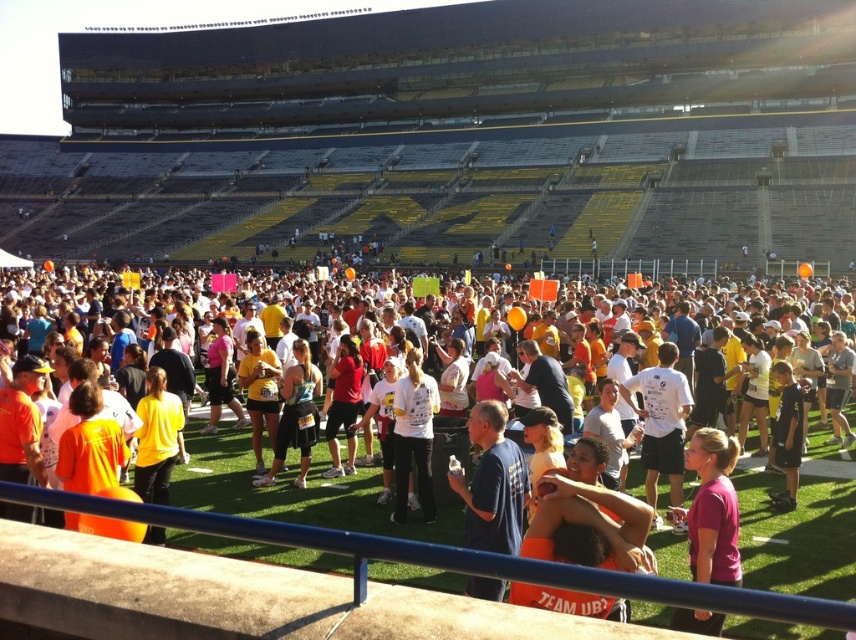
Question: Which point is closer to the camera?

Choices:
 (A) (497, 452)
 (B) (449, 497)
 (C) (153, 538)
 (D) (403, 406)

Answer: (A)

Question: Can you confirm if blue cotton shirt at center is positioned below matte black tank top at center?

Choices:
 (A) yes
 (B) no

Answer: (B)

Question: Is blue cotton shirt at center behind purple matte shirt at center?

Choices:
 (A) yes
 (B) no

Answer: (A)

Question: Is white matte t-shirt at center positioned at the back of yellow matte shirt at center?

Choices:
 (A) no
 (B) yes

Answer: (B)

Question: Estimate the real-world distances between objects in this image. Which object is farther from the white cotton shirt at center?

Choices:
 (A) matte black tank top at center
 (B) blue cotton shirt at center

Answer: (B)

Question: Which point is closer to the camera taking this photo?

Choices:
 (A) (676, 570)
 (B) (673, 422)
 (C) (520, 492)
 (D) (314, 442)

Answer: (C)